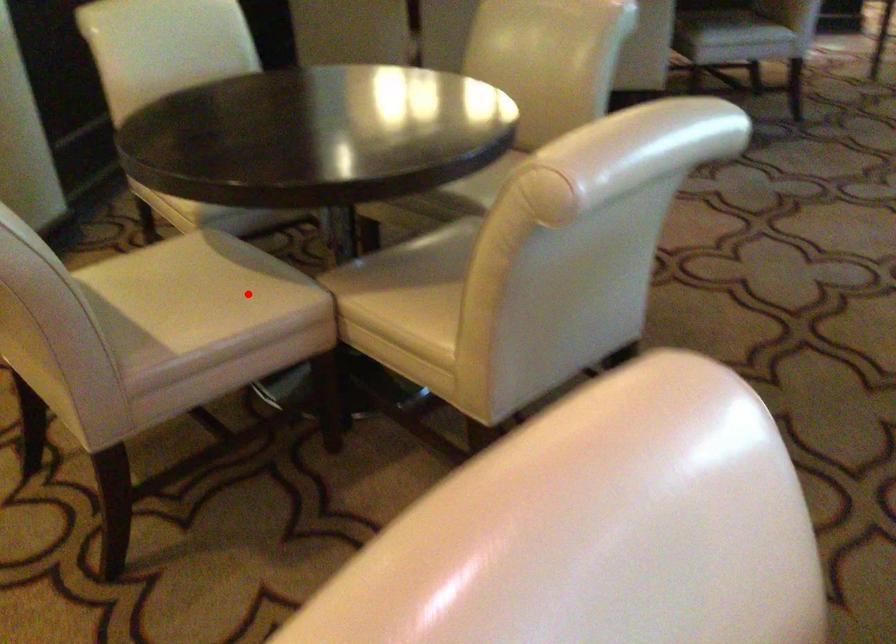
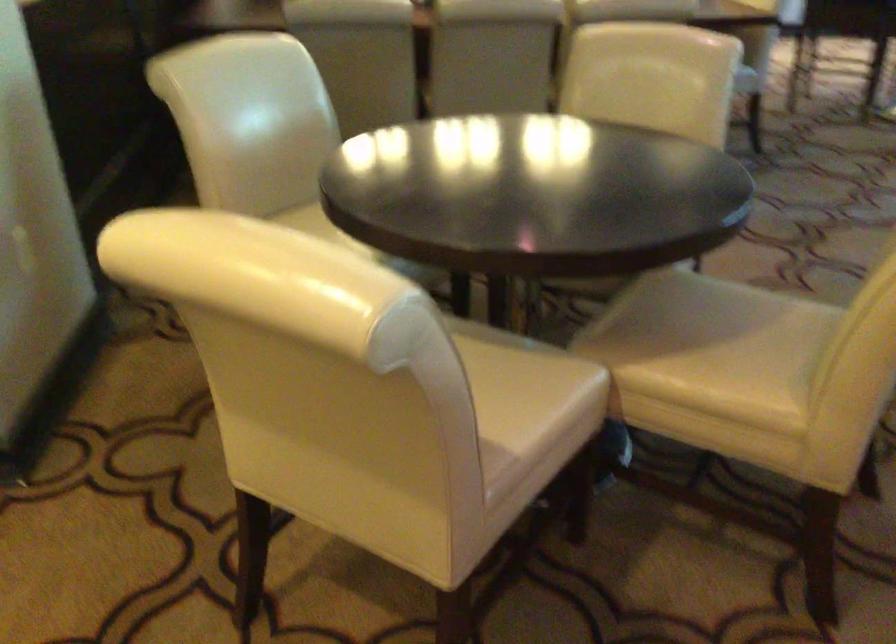
Question: I am providing you with two images of the same scene from different viewpoints. Image1 has a red point marked. In image2, the corresponding 3D location appears at what relative position? Reply with the corresponding letter.

Choices:
 (A) Closer
 (B) Farther

Answer: (A)